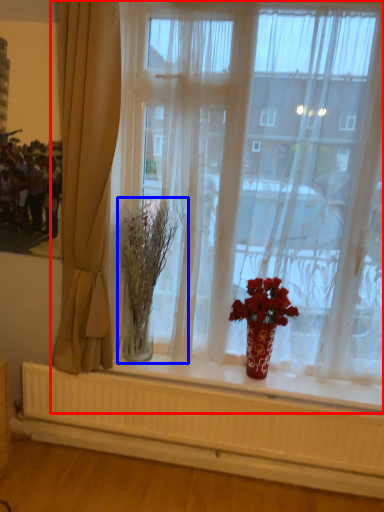
Question: Which object is closer to the camera taking this photo, window (highlighted by a red box) or plant (highlighted by a blue box)?

Choices:
 (A) window
 (B) plant

Answer: (A)